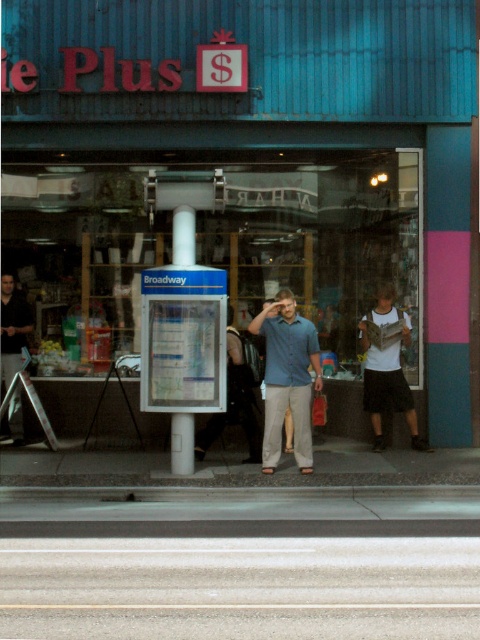
Question: Does transparent glass shop window at center have a larger size compared to blue cotton shirt at center?

Choices:
 (A) yes
 (B) no

Answer: (B)

Question: Is transparent glass shop window at center smaller than white cotton t-shirt at center?

Choices:
 (A) no
 (B) yes

Answer: (B)

Question: Which point is closer to the camera taking this photo?

Choices:
 (A) (9, 337)
 (B) (395, 353)
 (C) (279, 429)
 (D) (64, 275)

Answer: (C)

Question: Which object appears farthest from the camera in this image?

Choices:
 (A) blue cotton shirt at center
 (B) white cotton t-shirt at center
 (C) transparent glass shop window at center
 (D) dark gray shirt at left

Answer: (C)

Question: Which object is positioned closest to the transparent glass shop window at center?

Choices:
 (A) dark gray shirt at left
 (B) blue cotton shirt at center
 (C) white cotton t-shirt at center

Answer: (C)

Question: Is white cotton t-shirt at center further to the viewer compared to dark gray shirt at left?

Choices:
 (A) no
 (B) yes

Answer: (A)